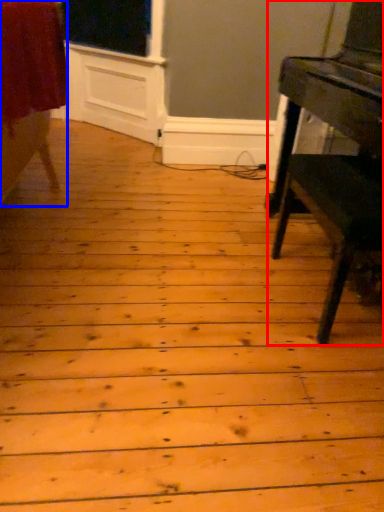
Question: Which object appears farthest to the camera in this image, table (highlighted by a red box) or furniture (highlighted by a blue box)?

Choices:
 (A) table
 (B) furniture

Answer: (B)